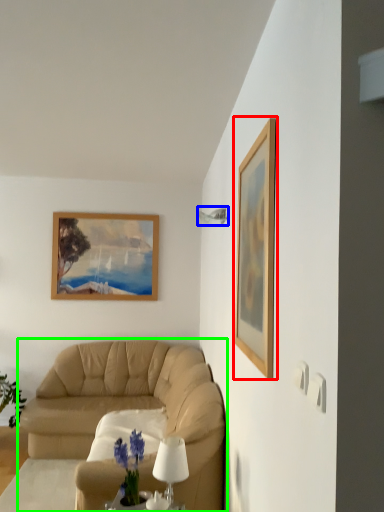
Question: Estimate the real-world distances between objects in this image. Which object is farther from picture frame (highlighted by a red box), lamp (highlighted by a blue box) or studio couch (highlighted by a green box)?

Choices:
 (A) lamp
 (B) studio couch

Answer: (B)